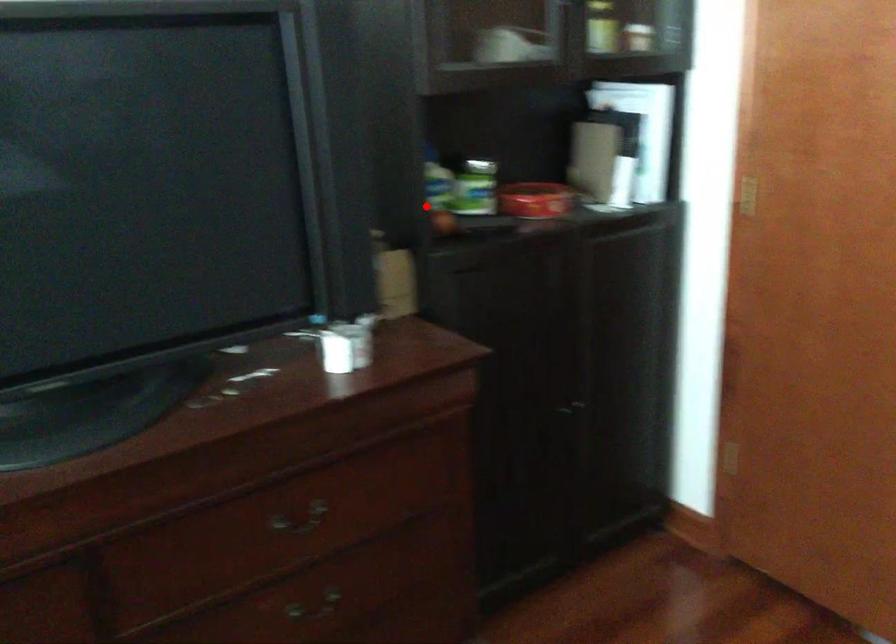
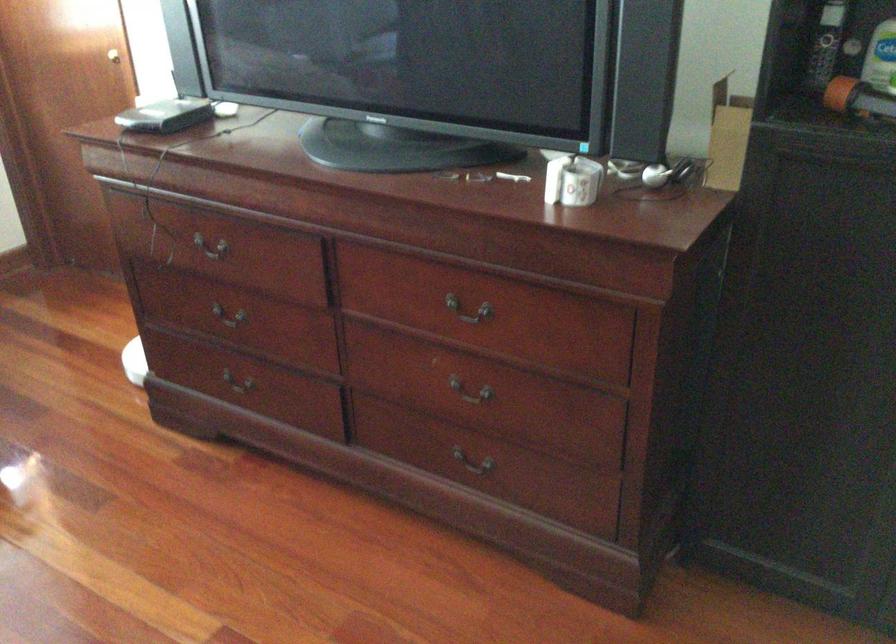
Find the pixel in the second image that matches the highlighted location in the first image.

(883, 77)